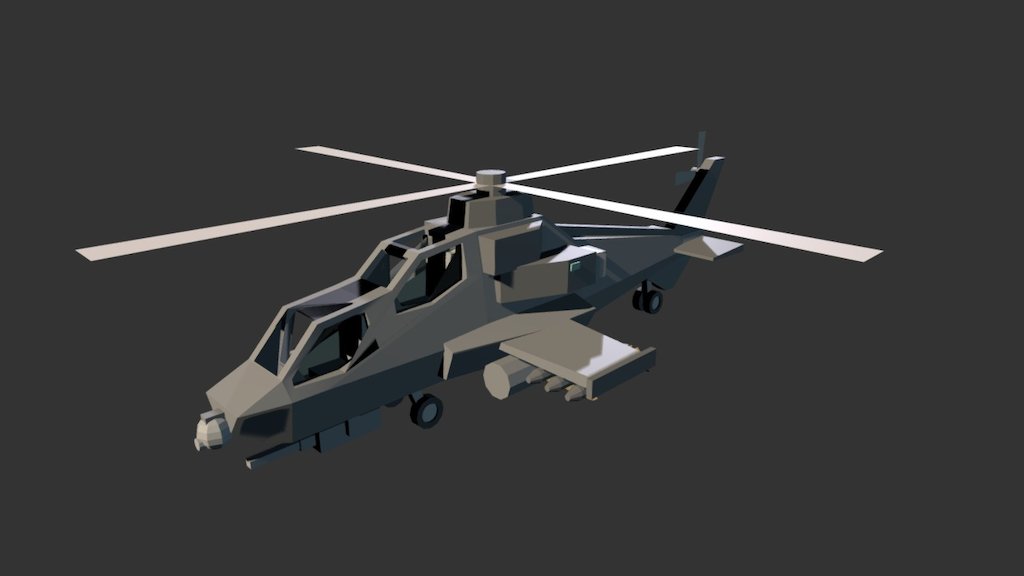
This screenshot has height=576, width=1024. Find the location of `light`. light is located at coordinates (202, 434).